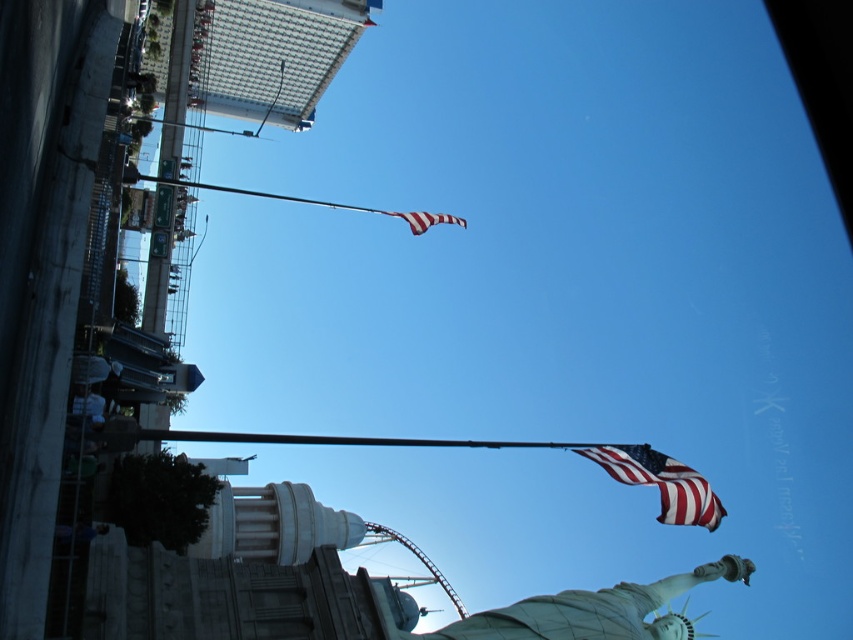
Question: Where is polished metal flag pole at upper center located in relation to american flag at upper center in the image?

Choices:
 (A) below
 (B) above

Answer: (B)

Question: Considering the real-world distances, which object is farthest from the american flag at upper center?

Choices:
 (A) shiny silver statue at lower center
 (B) polished metal flag pole at upper center
 (C) american flag at center

Answer: (A)

Question: Which of these objects is positioned closest to the shiny silver statue at lower center?

Choices:
 (A) american flag at upper center
 (B) polished metal flag pole at upper center
 (C) american flag at center

Answer: (C)

Question: Can you confirm if shiny silver statue at lower center is smaller than polished metal flag pole at upper center?

Choices:
 (A) no
 (B) yes

Answer: (B)

Question: Does shiny silver statue at lower center have a larger size compared to american flag at upper center?

Choices:
 (A) no
 (B) yes

Answer: (B)

Question: Which of the following is the farthest from the observer?

Choices:
 (A) american flag at upper center
 (B) polished metal flag pole at upper center
 (C) american flag at center

Answer: (A)